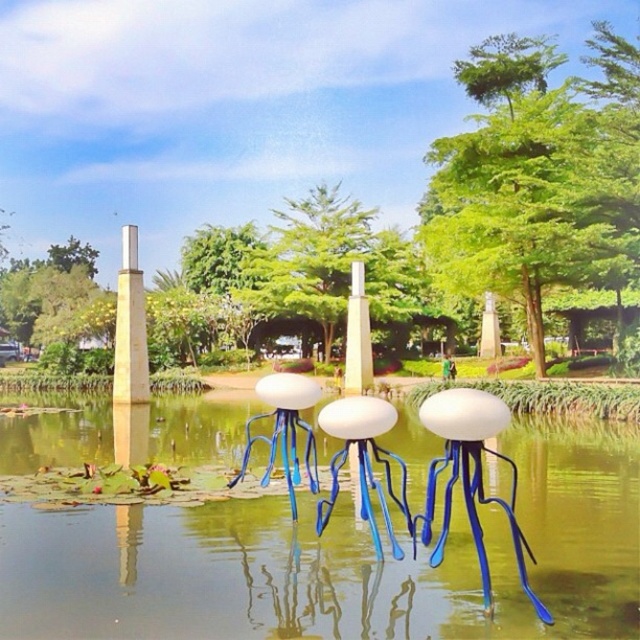
Is green leafy tree at upper right smaller than white matte stool at center?

Incorrect, green leafy tree at upper right is not smaller in size than white matte stool at center.

Is point (632, 52) closer to camera compared to point (333, 497)?

No, it is not.

Identify the location of green leafy tree at upper right. (536, 179).

Between transparent glass jellyfish at center and translucent glass jellyfish at center, which one has more height?

translucent glass jellyfish at center is taller.

Does point (600, 520) come in front of point (292, 452)?

No, (600, 520) is further to viewer.

Find the location of a particular element. The width and height of the screenshot is (640, 640). transparent glass jellyfish at center is located at coordinates (339, 561).

Does white matte stool at center have a lesser height compared to yellow polished stone pillar at center?

Yes.

Which is above, white matte stool at center or yellow polished stone pillar at center?

yellow polished stone pillar at center is higher up.

Find the location of a particular element. This screenshot has width=640, height=640. white matte stool at center is located at coordinates [364, 464].